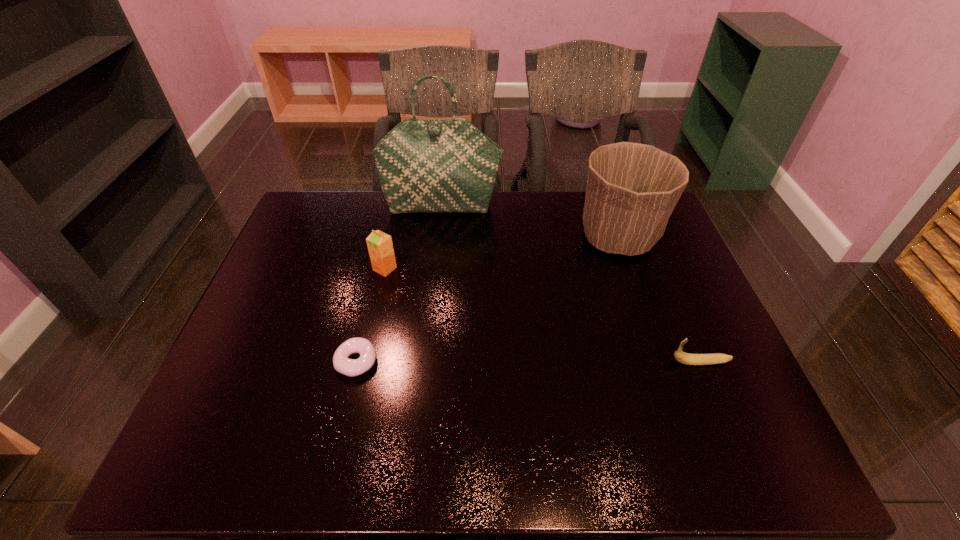
Identify the location of free space between the banana and the tallest object. This screenshot has height=540, width=960. click(x=571, y=284).

Identify which object is located as the nearest to the fourth tallest object. Please provide its 2D coordinates. Your answer should be formatted as a tuple, i.e. [(x, y)], where the tuple contains the x and y coordinates of a point satisfying the conditions above.

[(632, 189)]

Locate which object is the closest to the flowerpot. Please provide its 2D coordinates. Your answer should be formatted as a tuple, i.e. [(x, y)], where the tuple contains the x and y coordinates of a point satisfying the conditions above.

[(448, 165)]

Locate an element on the screen. free location that satisfies the following two spatial constraints: 1. on the front side of the flowerpot; 2. on the right side of the tote bag is located at coordinates (439, 238).

Image resolution: width=960 pixels, height=540 pixels. What are the coordinates of `vacant region that satisfies the following two spatial constraints: 1. on the back side of the fourth shortest object; 2. on the right side of the shortest object` in the screenshot? It's located at (386, 238).

Locate an element on the screen. vacant space that satisfies the following two spatial constraints: 1. on the front side of the flowerpot; 2. on the right side of the tote bag is located at coordinates (439, 238).